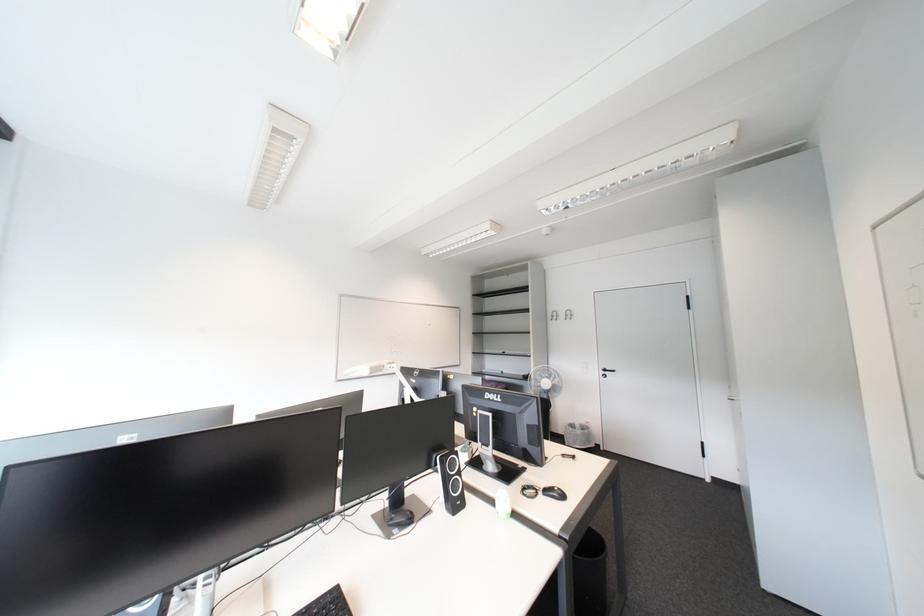
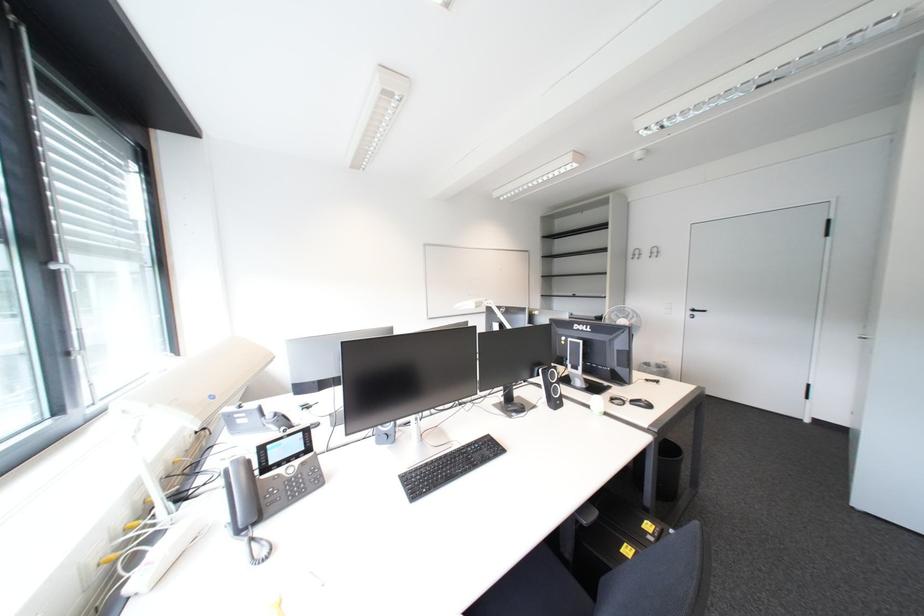
In a continuous first-person perspective shot, in which direction is the camera moving?

The movement direction of the cameraman is left, backward.